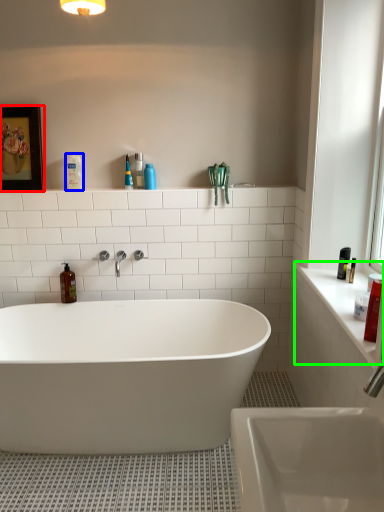
Question: Based on their relative distances, which object is nearer to picture frame (highlighted by a red box)? Choose from toiletry (highlighted by a blue box) and counter top (highlighted by a green box).

Choices:
 (A) toiletry
 (B) counter top

Answer: (A)